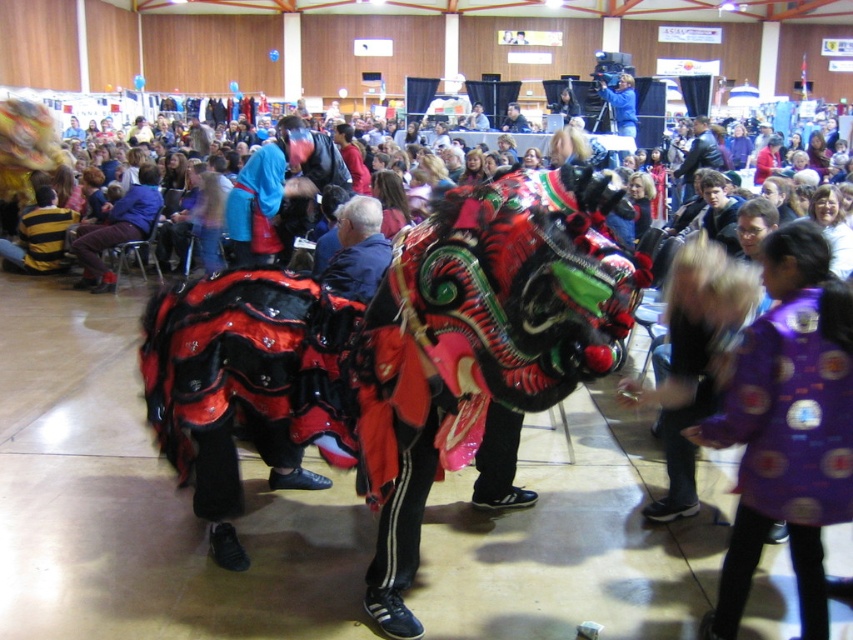
You are standing at the origin point in the image, which is the bottom left corner. The dragon dance is happening in the foreground. Where is the leather jacket at center located in terms of coordinates?

The leather jacket at center is located at coordinates point (698, 156).

You are a photographer at the event and want to capture a photo that includes both the purple fabric costume at lower right and the matte blue jacket at center. Which object should you focus on first to ensure both are in frame?

The purple fabric costume at lower right is taller than the matte blue jacket at center, so focus on the purple fabric costume at lower right first to ensure both are in frame.